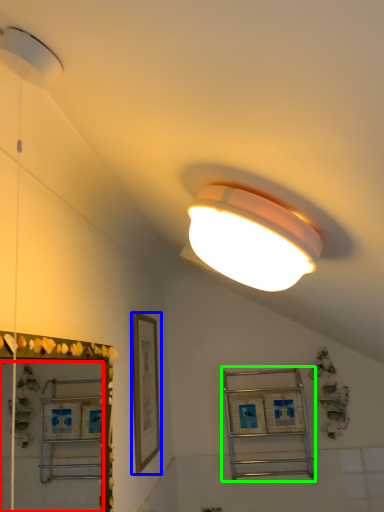
Question: Estimate the real-world distances between objects in this image. Which object is closer to mirror (highlighted by a red box), picture frame (highlighted by a blue box) or shelf (highlighted by a green box)?

Choices:
 (A) picture frame
 (B) shelf

Answer: (A)